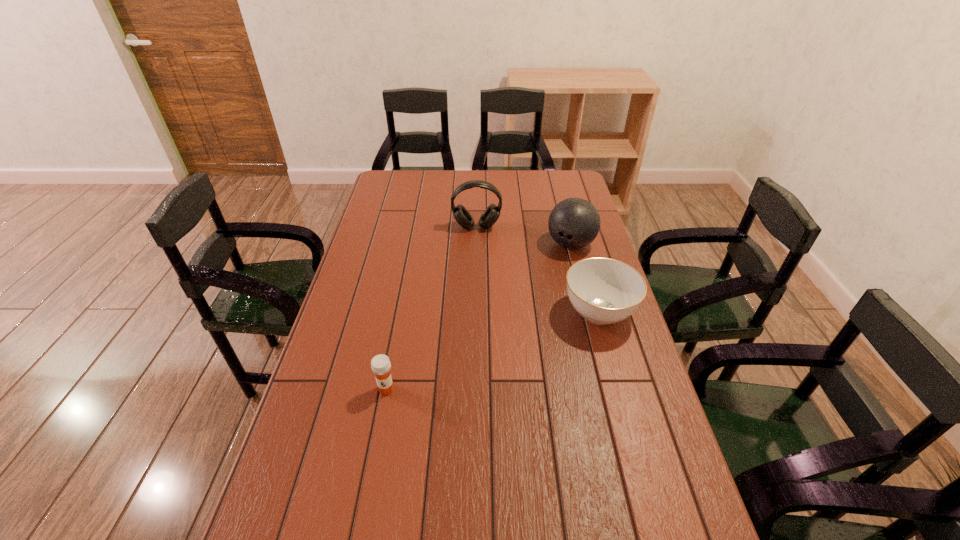
This screenshot has width=960, height=540. Identify the location of free region at the near left corner. (279, 528).

Locate an element on the screen. The height and width of the screenshot is (540, 960). vacant space at the far right corner of the desktop is located at coordinates (554, 192).

Where is `vacant space at the near right corner of the desktop`? vacant space at the near right corner of the desktop is located at coordinates (659, 531).

I want to click on free space that is in between the third farthest object and the headset, so click(x=538, y=269).

Locate an element on the screen. The height and width of the screenshot is (540, 960). vacant area that lies between the third farthest object and the nearest object is located at coordinates (492, 350).

You are a GUI agent. You are given a task and a screenshot of the screen. Output one action in this format:
    pyautogui.click(x=<x>, y=<y>)
    Task: Click on the free space between the bowling ball and the nearest object
    
    Given the screenshot: What is the action you would take?
    pyautogui.click(x=478, y=316)

Identify the location of empty space between the leftmost object and the bowling ball. (478, 316).

Where is `vacant area that lies between the third object from right to left and the leftmost object`? The image size is (960, 540). vacant area that lies between the third object from right to left and the leftmost object is located at coordinates (x=431, y=308).

At what (x,y) coordinates should I click in order to perform the action: click on empty location between the chinaware and the second object from left to right. Please return your answer as a coordinate pair (x, y). This screenshot has width=960, height=540. Looking at the image, I should click on [x=538, y=269].

Choose which object is the third nearest neighbor to the chinaware. Please provide its 2D coordinates. Your answer should be formatted as a tuple, i.e. [(x, y)], where the tuple contains the x and y coordinates of a point satisfying the conditions above.

[(380, 364)]